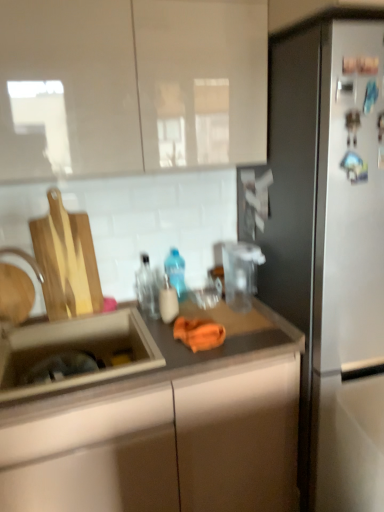
Locate an element on the screen. The width and height of the screenshot is (384, 512). free location to the right of matte plastic soap dispenser at center, marked as the third bottle in a back-to-front arrangement is located at coordinates (218, 318).